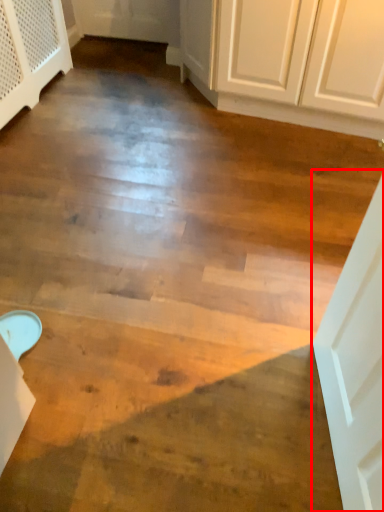
Question: Considering the relative positions of door (annotated by the red box) and dresser in the image provided, where is door (annotated by the red box) located with respect to the staircase?

Choices:
 (A) left
 (B) right

Answer: (B)